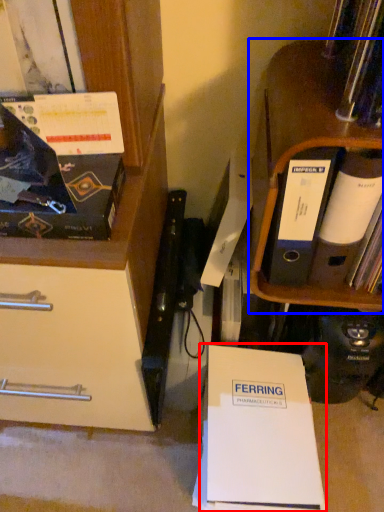
Question: Which point is further to the camera, paperback book (highlighted by a red box) or shelf (highlighted by a blue box)?

Choices:
 (A) paperback book
 (B) shelf

Answer: (A)